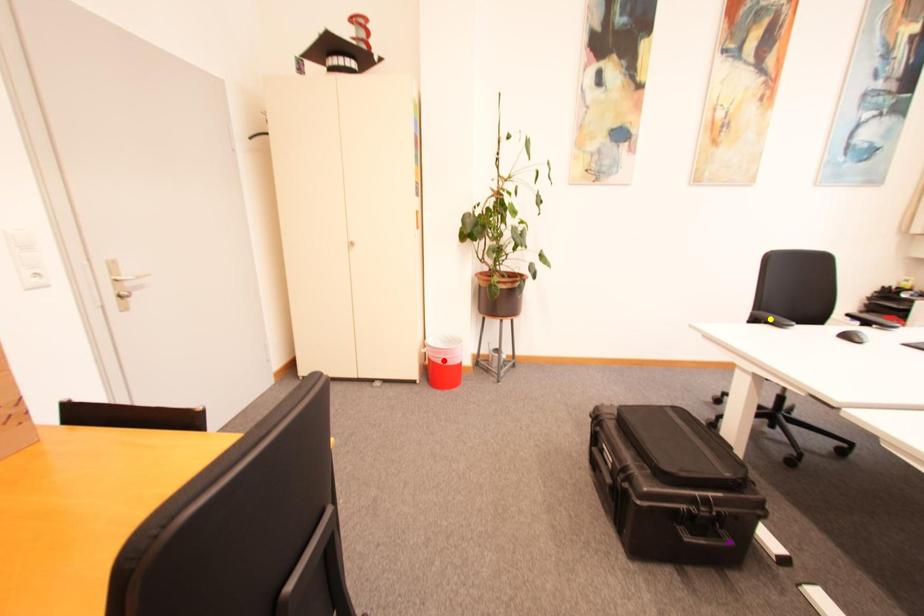
Order these from nearest to farthest:
purple point
yellow point
red point

1. red point
2. yellow point
3. purple point